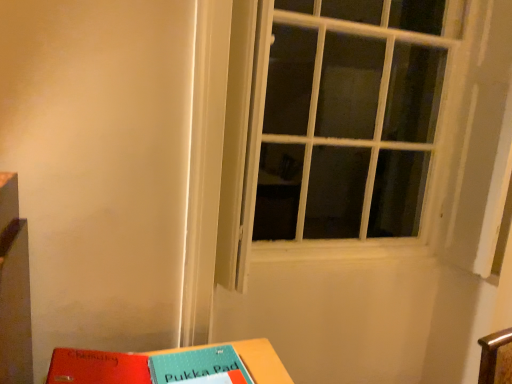
Question: Is white textured window at center at the back of matte plastic table at lower center?

Choices:
 (A) yes
 (B) no

Answer: (B)

Question: Are matte plastic table at lower center and white textured window at center beside each other?

Choices:
 (A) no
 (B) yes

Answer: (A)

Question: From the image's perspective, is matte plastic table at lower center beneath white textured window at center?

Choices:
 (A) yes
 (B) no

Answer: (A)

Question: Could you tell me if matte plastic table at lower center is facing white textured window at center?

Choices:
 (A) no
 (B) yes

Answer: (A)

Question: From the image's perspective, is matte plastic table at lower center over white textured window at center?

Choices:
 (A) yes
 (B) no

Answer: (B)

Question: Is point (94, 349) positioned closer to the camera than point (360, 130)?

Choices:
 (A) closer
 (B) farther

Answer: (A)

Question: From the image's perspective, is red matte paper at lower left located above or below white textured window at center?

Choices:
 (A) above
 (B) below

Answer: (B)

Question: Looking at their shapes, would you say red matte paper at lower left is wider or thinner than white textured window at center?

Choices:
 (A) wide
 (B) thin

Answer: (A)

Question: In terms of height, does red matte paper at lower left look taller or shorter compared to white textured window at center?

Choices:
 (A) short
 (B) tall

Answer: (A)

Question: Considering the positions of point (61, 362) and point (220, 342), is point (61, 362) closer or farther from the camera than point (220, 342)?

Choices:
 (A) farther
 (B) closer

Answer: (B)

Question: From a real-world perspective, is red matte paper at lower left physically located above or below matte plastic table at lower center?

Choices:
 (A) below
 (B) above

Answer: (B)

Question: In the image, is red matte paper at lower left on the left side or the right side of matte plastic table at lower center?

Choices:
 (A) left
 (B) right

Answer: (A)

Question: Looking at their shapes, would you say red matte paper at lower left is wider or thinner than matte plastic table at lower center?

Choices:
 (A) thin
 (B) wide

Answer: (A)

Question: From the image's perspective, is white textured window at center located above or below red matte paper at lower left?

Choices:
 (A) below
 (B) above

Answer: (B)

Question: Relative to red matte paper at lower left, is white textured window at center in front or behind?

Choices:
 (A) behind
 (B) front

Answer: (A)